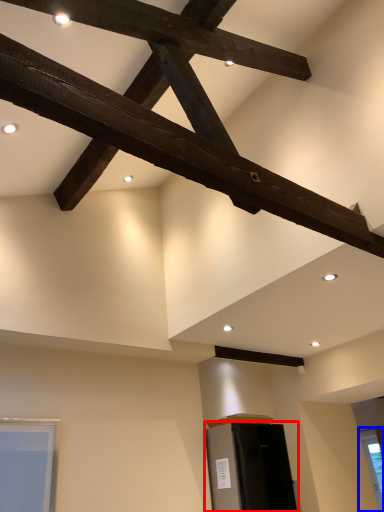
Question: Among these objects, which one is farthest to the camera, furniture (highlighted by a red box) or window (highlighted by a blue box)?

Choices:
 (A) furniture
 (B) window

Answer: (B)